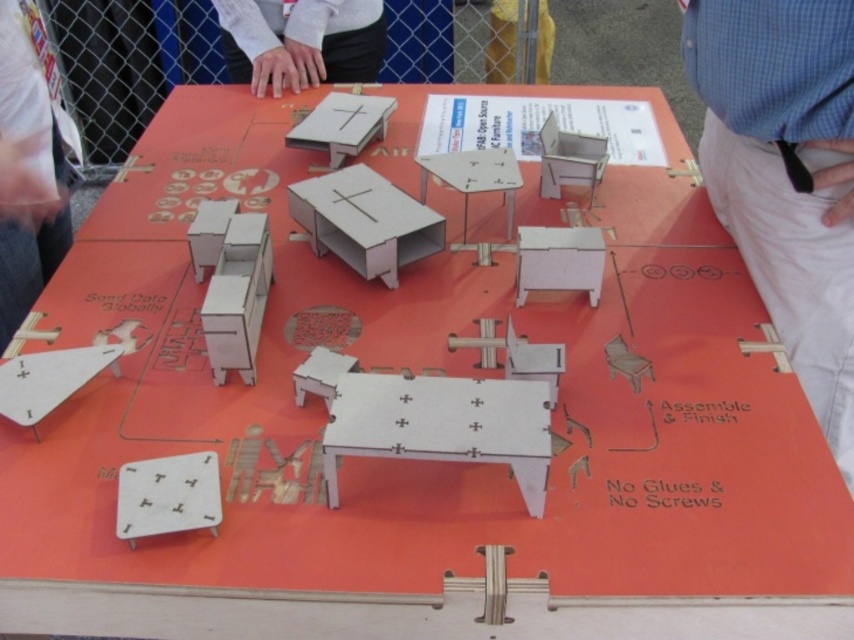
Question: Which of the following is the farthest from the observer?

Choices:
 (A) blue shirt at upper right
 (B) white matte shirt at upper center
 (C) pink fabric at left
 (D) white matte table at center

Answer: (B)

Question: Considering the real-world distances, which object is farthest from the pink fabric at left?

Choices:
 (A) matte wood table at center
 (B) white matte table at center
 (C) white matte shirt at upper center
 (D) blue shirt at upper right

Answer: (D)

Question: Can you confirm if white matte table at center is smaller than matte wood table at center?

Choices:
 (A) yes
 (B) no

Answer: (A)

Question: Can you confirm if pink fabric at left is wider than white matte shirt at upper center?

Choices:
 (A) no
 (B) yes

Answer: (A)

Question: Is pink fabric at left thinner than white matte shirt at upper center?

Choices:
 (A) yes
 (B) no

Answer: (A)

Question: Considering the real-world distances, which object is farthest from the pink fabric at left?

Choices:
 (A) white matte shirt at upper center
 (B) blue shirt at upper right

Answer: (B)